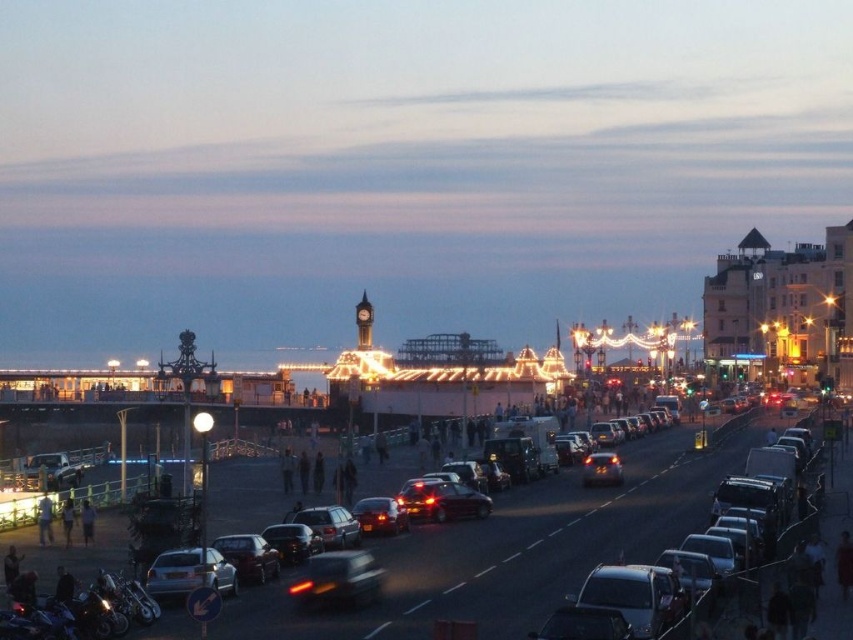
Is point (351, 522) positioned after point (611, 477)?

No.

Is point (334, 545) in front of point (619, 480)?

Yes, point (334, 545) is closer to viewer.

Does point (293, 518) come closer to viewer compared to point (601, 468)?

Yes.

This screenshot has height=640, width=853. Find the location of `satin silver sedan at center`. satin silver sedan at center is located at coordinates [x=328, y=524].

Is point (474, 508) closer to viewer compared to point (83, 518)?

No, it is not.

Is shiny metallic car at center wider than light brown leather jacket at lower left?

Yes, shiny metallic car at center is wider than light brown leather jacket at lower left.

Does point (416, 509) come behind point (85, 502)?

Yes, it is behind point (85, 502).

Find the location of a particular element. The width and height of the screenshot is (853, 640). shiny metallic car at center is located at coordinates (442, 500).

Does shiny metallic car at center appear under satin silver sedan at center?

Actually, shiny metallic car at center is above satin silver sedan at center.

Does point (405, 484) lie in front of point (323, 513)?

That is False.

Which is behind, point (448, 502) or point (357, 532)?

The point (448, 502) is behind.

The height and width of the screenshot is (640, 853). What are the coordinates of `shiny metallic car at center` in the screenshot? It's located at (442, 500).